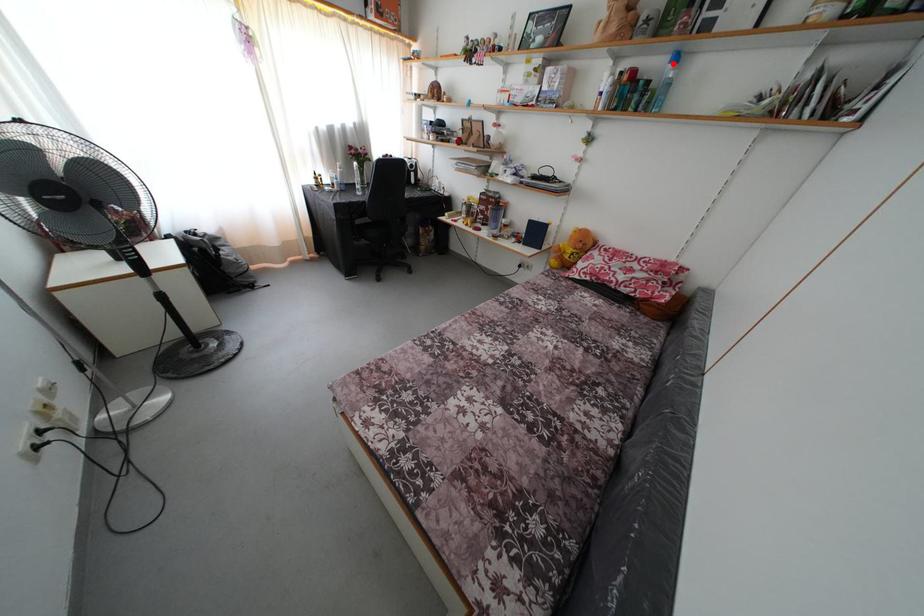
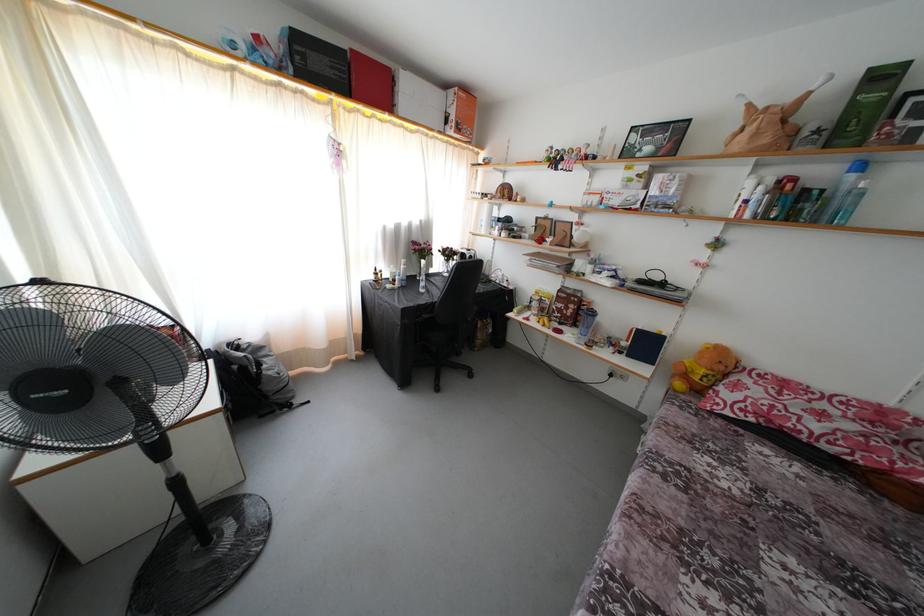
The point at the highlighted location is marked in the first image. Where is the corresponding point in the second image?

(849, 172)